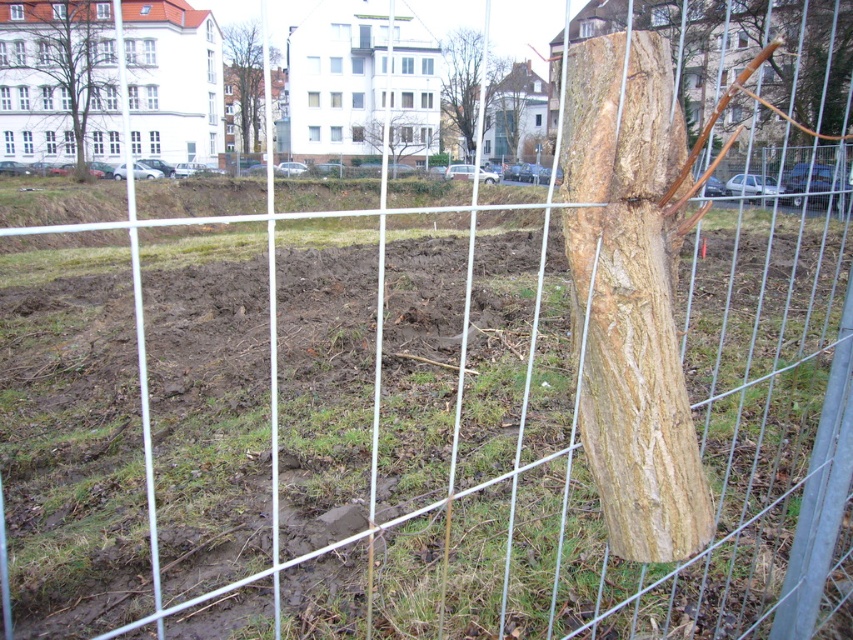
From the picture: Does smooth brown tree trunk at center have a greater height compared to brown rough tree at upper center?

Correct, smooth brown tree trunk at center is much taller as brown rough tree at upper center.

In the scene shown: Is smooth brown tree trunk at center wider than brown rough tree at upper center?

No, smooth brown tree trunk at center is not wider than brown rough tree at upper center.

Is point (465, 113) positioned before point (355, 141)?

No.

The width and height of the screenshot is (853, 640). What are the coordinates of `smooth brown tree trunk at center` in the screenshot? It's located at (462, 84).

Looking at this image, does light brown wood at upper right have a lesser width compared to brown rough tree at upper left?

Correct, light brown wood at upper right's width is less than brown rough tree at upper left's.

Does point (695, 81) lie behind point (68, 56)?

That is False.

Locate an element on the screen. The width and height of the screenshot is (853, 640). light brown wood at upper right is located at coordinates (756, 52).

Does light brown wood at center have a lesser width compared to light brown wood at upper right?

Correct, light brown wood at center's width is less than light brown wood at upper right's.

The height and width of the screenshot is (640, 853). What do you see at coordinates (630, 298) in the screenshot?
I see `light brown wood at center` at bounding box center [630, 298].

Where is `light brown wood at center`? This screenshot has width=853, height=640. light brown wood at center is located at coordinates (630, 298).